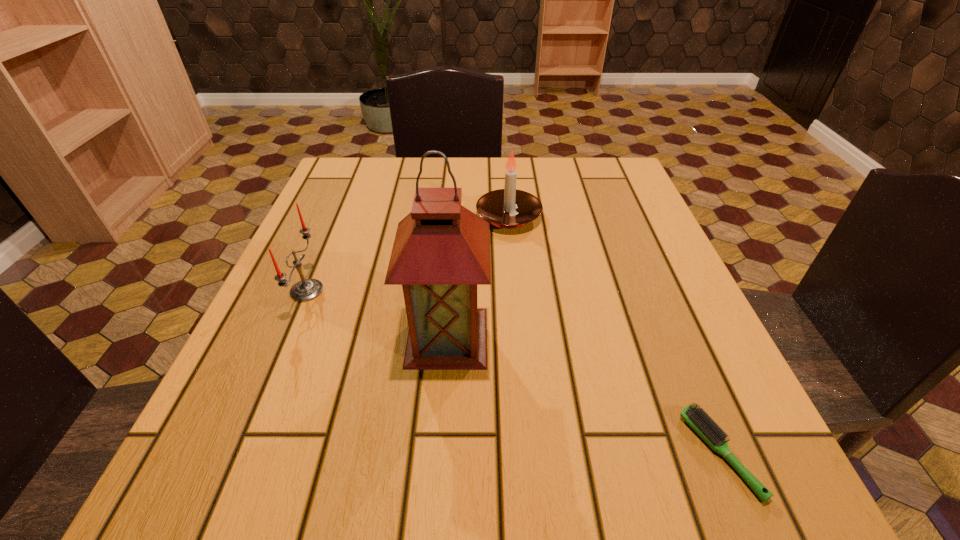
Where is `vacant space located 0.220m on the back of the hairbrush`? The height and width of the screenshot is (540, 960). vacant space located 0.220m on the back of the hairbrush is located at coordinates (657, 301).

In order to click on object at the far edge in this screenshot , I will do `click(508, 208)`.

You are a GUI agent. You are given a task and a screenshot of the screen. Output one action in this format:
    pyautogui.click(x=<x>, y=<y>)
    Task: Click on the object that is at the near edge
    This screenshot has height=540, width=960.
    Given the screenshot: What is the action you would take?
    pyautogui.click(x=697, y=418)

Where is `object located at the left edge`? object located at the left edge is located at coordinates (305, 290).

Locate an element on the screen. The width and height of the screenshot is (960, 540). object that is at the right edge is located at coordinates (697, 418).

In order to click on object present at the near right corner in this screenshot , I will do `click(697, 418)`.

Locate an element on the screen. The width and height of the screenshot is (960, 540). vacant space at the far edge of the desktop is located at coordinates (401, 205).

The width and height of the screenshot is (960, 540). Identify the location of vacant space at the near edge of the desktop. (347, 476).

In the image, there is a desktop. Where is `vacant space at the left edge`? The height and width of the screenshot is (540, 960). vacant space at the left edge is located at coordinates (293, 350).

In the image, there is a desktop. At what (x,y) coordinates should I click in order to perform the action: click on vacant space at the right edge. Please return your answer as a coordinate pair (x, y). Looking at the image, I should click on (640, 272).